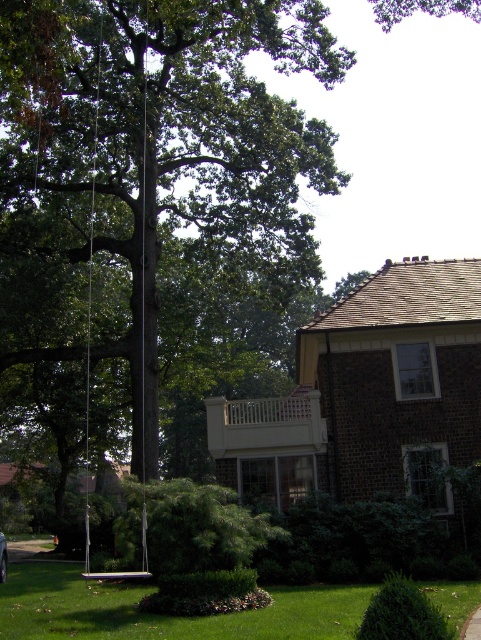
Can you confirm if green grass at lower center is positioned to the right of metallic silver car at lower left?

Yes, green grass at lower center is to the right of metallic silver car at lower left.

Between point (268, 620) and point (0, 561), which one is positioned in front?

Point (268, 620)

Find the location of a particular element. green grass at lower center is located at coordinates (163, 616).

In order to click on green grass at lower center in this screenshot , I will do `click(163, 616)`.

Does metallic silver swing at left have a greater height compared to metallic silver car at lower left?

Indeed, metallic silver swing at left has a greater height compared to metallic silver car at lower left.

Who is positioned more to the right, metallic silver swing at left or metallic silver car at lower left?

Positioned to the right is metallic silver car at lower left.

Measure the distance between metallic silver swing at left and camera.

metallic silver swing at left and camera are 11.44 meters apart from each other.

The height and width of the screenshot is (640, 481). In order to click on metallic silver swing at left in this screenshot , I will do `click(139, 323)`.

Does green leafy tree at center have a lesser height compared to green grass at lower center?

No.

Identify the location of green leafy tree at center. (156, 140).

Find the location of a particular element. Image resolution: width=481 pixels, height=640 pixels. green leafy tree at center is located at coordinates (156, 140).